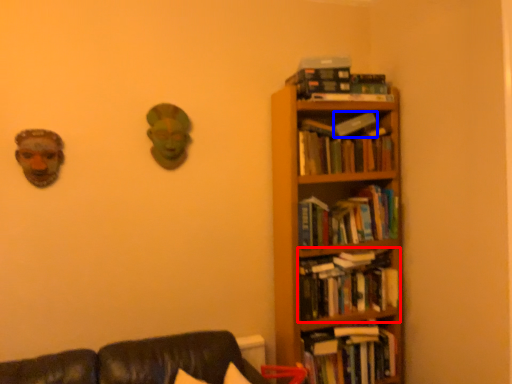
Question: Which point is further to the camera, book (highlighted by a red box) or paperback book (highlighted by a blue box)?

Choices:
 (A) book
 (B) paperback book

Answer: (B)